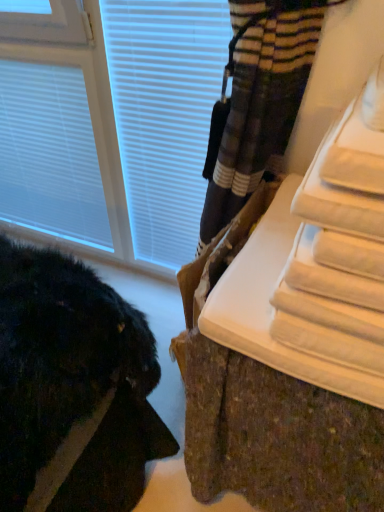
Question: Considering the relative sizes of white matte blind at upper left and white plastic window at upper left in the image provided, is white matte blind at upper left wider than white plastic window at upper left?

Choices:
 (A) no
 (B) yes

Answer: (A)

Question: Is white matte blind at upper left not within white plastic window at upper left?

Choices:
 (A) yes
 (B) no

Answer: (B)

Question: From the image's perspective, is white matte blind at upper left above white plastic window at upper left?

Choices:
 (A) yes
 (B) no

Answer: (A)

Question: Is white matte blind at upper left at the left side of white plastic window at upper left?

Choices:
 (A) no
 (B) yes

Answer: (B)

Question: From a real-world perspective, is white matte blind at upper left positioned under white plastic window at upper left based on gravity?

Choices:
 (A) yes
 (B) no

Answer: (A)

Question: Is white plastic window at upper left bigger or smaller than white matte blind at upper left?

Choices:
 (A) small
 (B) big

Answer: (B)

Question: Does point (84, 197) appear closer or farther from the camera than point (44, 231)?

Choices:
 (A) farther
 (B) closer

Answer: (B)

Question: From their relative heights in the image, would you say white plastic window at upper left is taller or shorter than white matte blind at upper left?

Choices:
 (A) short
 (B) tall

Answer: (B)

Question: From the image's perspective, is white plastic window at upper left positioned above or below white matte blind at upper left?

Choices:
 (A) above
 (B) below

Answer: (B)

Question: From a real-world perspective, is white plastic window at upper left physically located above or below white textured radiator at lower right?

Choices:
 (A) above
 (B) below

Answer: (A)

Question: Looking at the image, does white plastic window at upper left seem bigger or smaller compared to white textured radiator at lower right?

Choices:
 (A) small
 (B) big

Answer: (B)

Question: Would you say white plastic window at upper left is inside or outside white textured radiator at lower right?

Choices:
 (A) inside
 (B) outside

Answer: (B)

Question: Is point (178, 76) positioned closer to the camera than point (278, 329)?

Choices:
 (A) closer
 (B) farther

Answer: (B)

Question: Looking at their shapes, would you say white matte blind at upper left is wider or thinner than white textured radiator at lower right?

Choices:
 (A) wide
 (B) thin

Answer: (B)

Question: Would you say white matte blind at upper left is to the left or to the right of white textured radiator at lower right in the picture?

Choices:
 (A) right
 (B) left

Answer: (B)